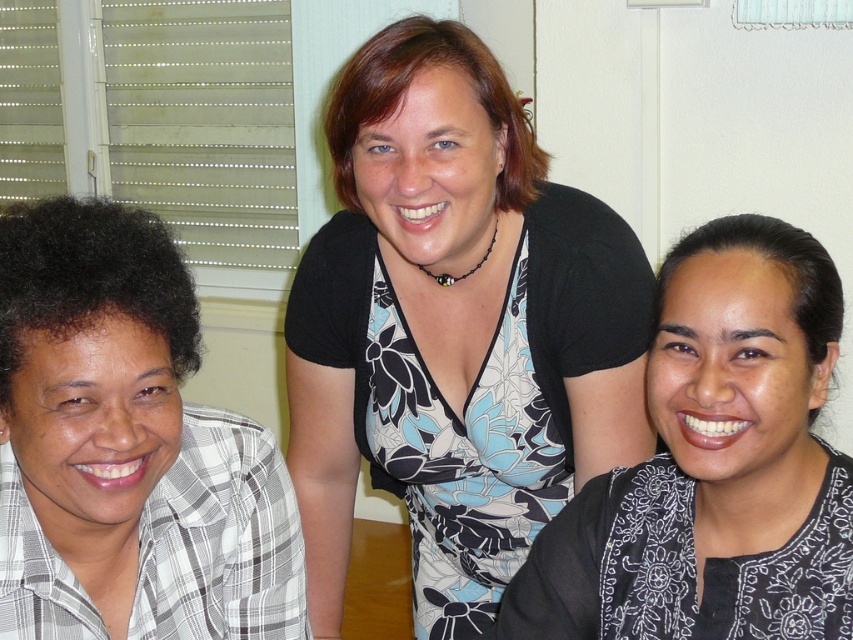
Who is lower down, white checkered shirt at left or black floral dress at center?

black floral dress at center is below.

The image size is (853, 640). What do you see at coordinates (129, 436) in the screenshot? I see `white checkered shirt at left` at bounding box center [129, 436].

Identify the location of white checkered shirt at left. (129, 436).

Is floral dress at center taller than black floral dress at center?

Yes.

The width and height of the screenshot is (853, 640). What do you see at coordinates (454, 330) in the screenshot?
I see `floral dress at center` at bounding box center [454, 330].

The height and width of the screenshot is (640, 853). I want to click on floral dress at center, so click(454, 330).

Is floral dress at center smaller than white checkered shirt at left?

Incorrect, floral dress at center is not smaller in size than white checkered shirt at left.

What do you see at coordinates (454, 330) in the screenshot? Image resolution: width=853 pixels, height=640 pixels. I see `floral dress at center` at bounding box center [454, 330].

Does point (347, 300) come farther from viewer compared to point (277, 588)?

Yes, it is.

I want to click on floral dress at center, so click(x=454, y=330).